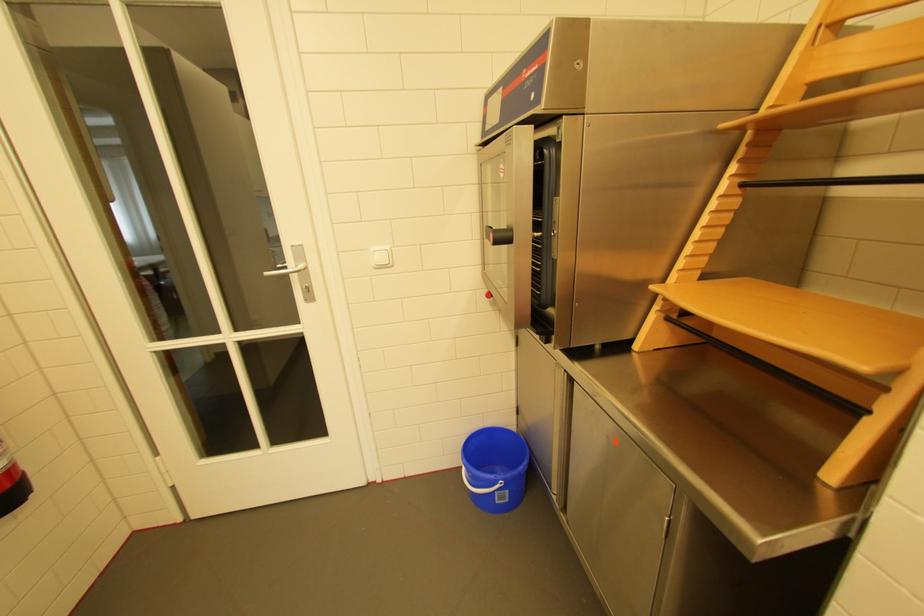
This screenshot has width=924, height=616. Describe the element at coordinates (499, 235) in the screenshot. I see `the black oven handle` at that location.